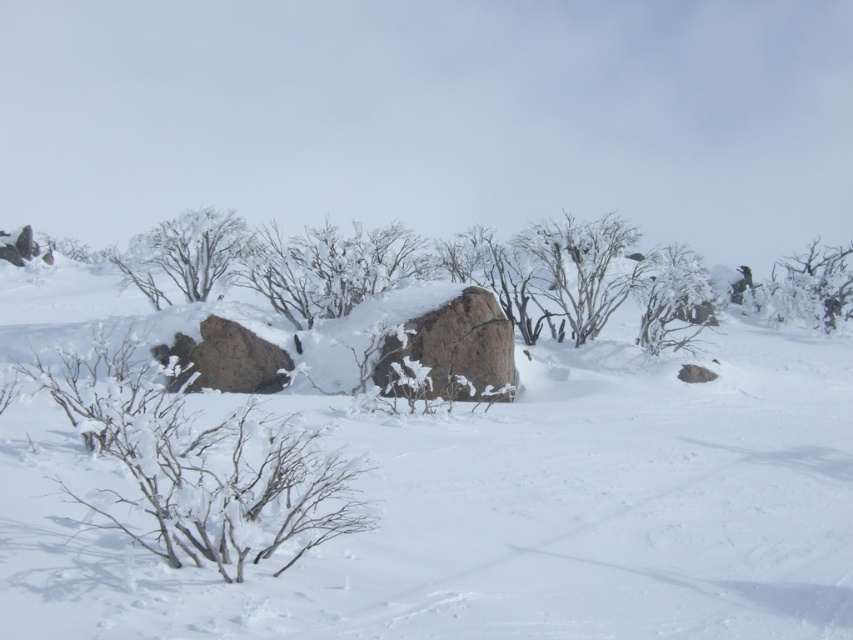
You are an observer standing in the winter landscape. You notice the white fluffy snow at center and the white frosty branches at upper right. Which object is taller?

The white frosty branches at upper right are taller than the white fluffy snow at center.

You are planning to build a snowman using the white fluffy snow at center and want to place a small decoration made from the white frosty branches at upper right on top of it. Given that the snowman requires at least 25 feet of snow and the decoration needs to be within 35 feet from the snow to ensure visibility, will both requirements be met?

The white fluffy snow at center is 30.41 feet from the white frosty branches at upper right. Since the snowman requires at least 25 feet of snow and the decoration needs to be within 35 feet from the snow, both requirements are met because 30.41 feet is greater than 25 feet and less than 35 feet.